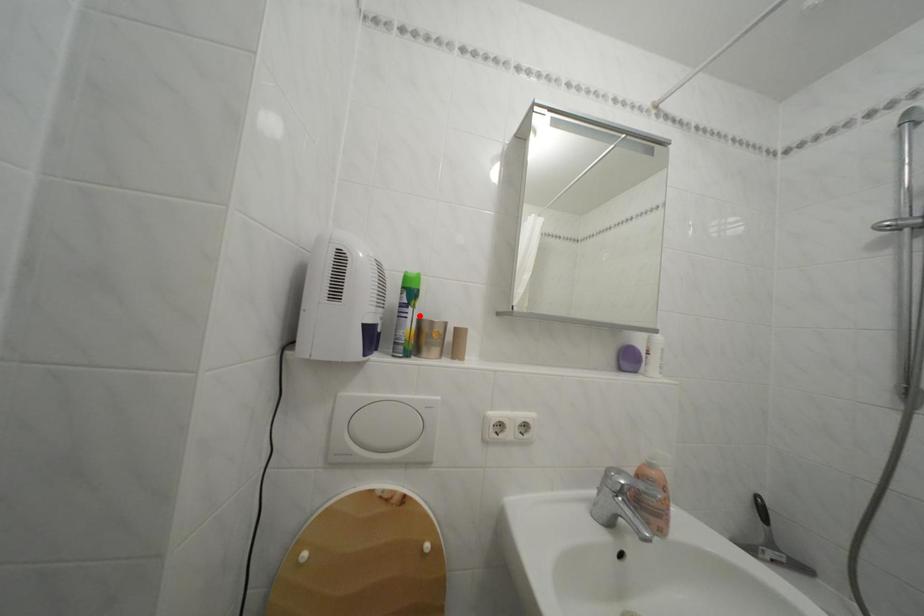
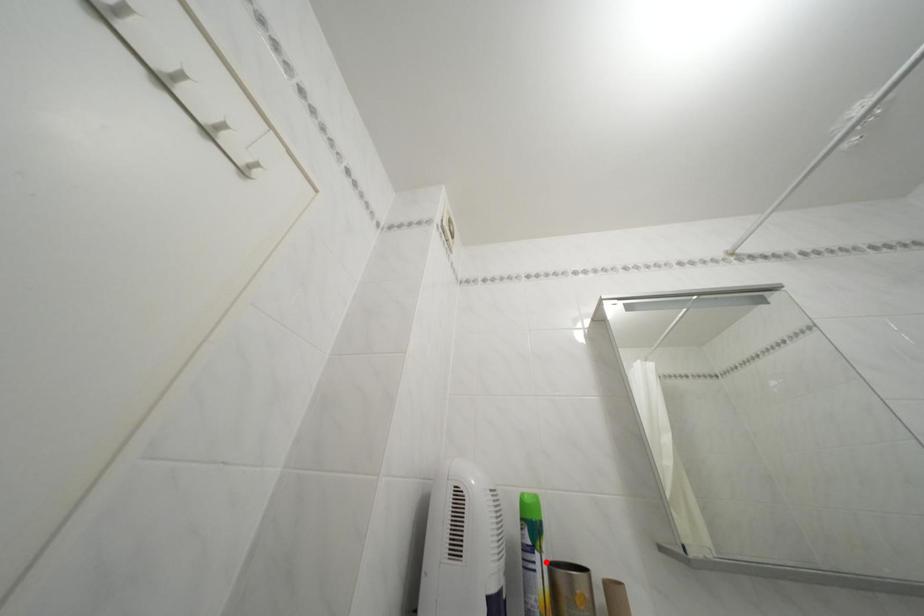
I am providing you with two images of the same scene from different viewpoints. A red point is marked on the first image and another point is marked on the second image. Is the marked point in image1 the same physical position as the marked point in image2?

Yes